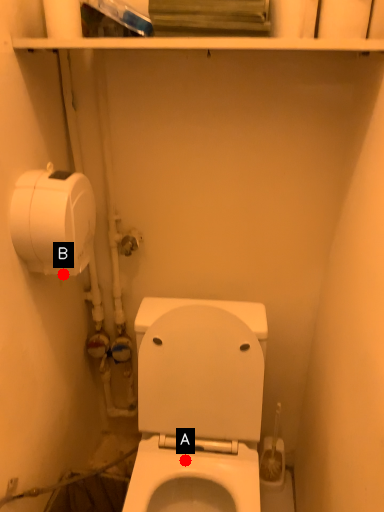
Question: Two points are circled on the image, labeled by A and B beside each circle. Which point is closer to the camera taking this photo?

Choices:
 (A) A is closer
 (B) B is closer

Answer: (B)